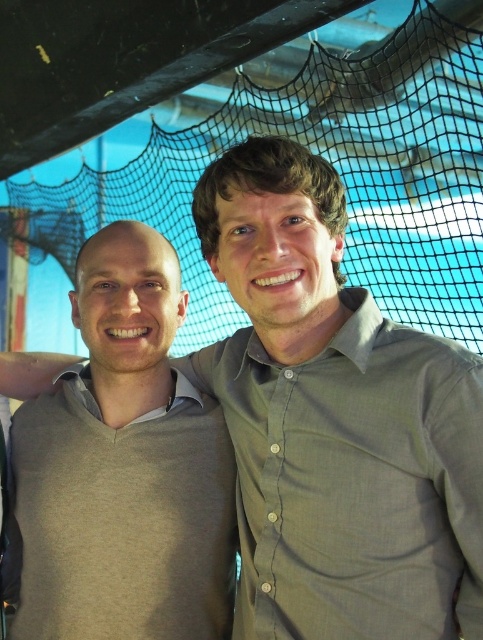
Looking at this image, does light gray sweater at center lie in front of black mesh net at upper center?

Yes, it is.

Is light gray sweater at center above black mesh net at upper center?

Actually, light gray sweater at center is below black mesh net at upper center.

Who is more forward, (136, 586) or (351, 140)?

Point (136, 586) is in front.

In order to click on light gray sweater at center in this screenshot , I will do `click(125, 467)`.